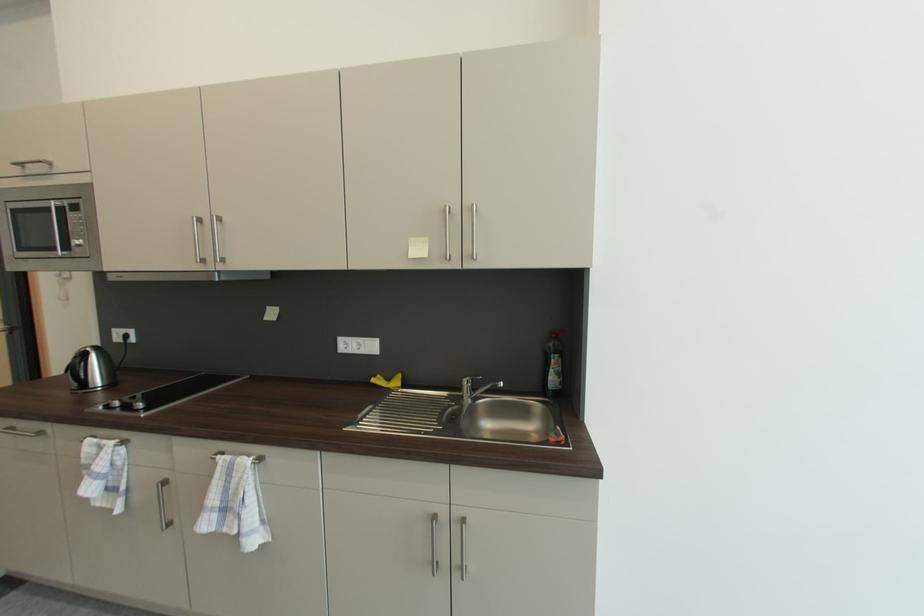
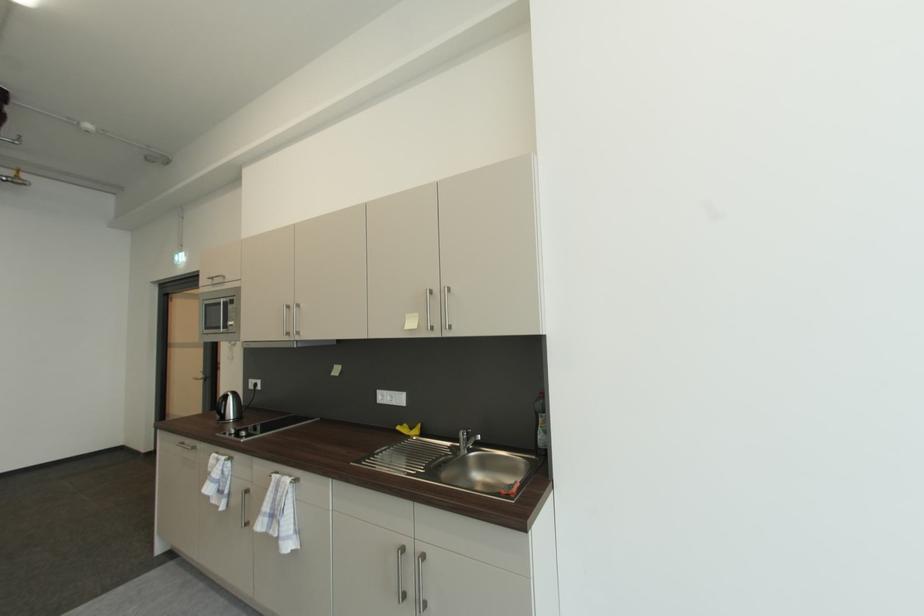
The point at [468,383] is marked in the first image. Where is the corresponding point in the second image?

(465, 435)